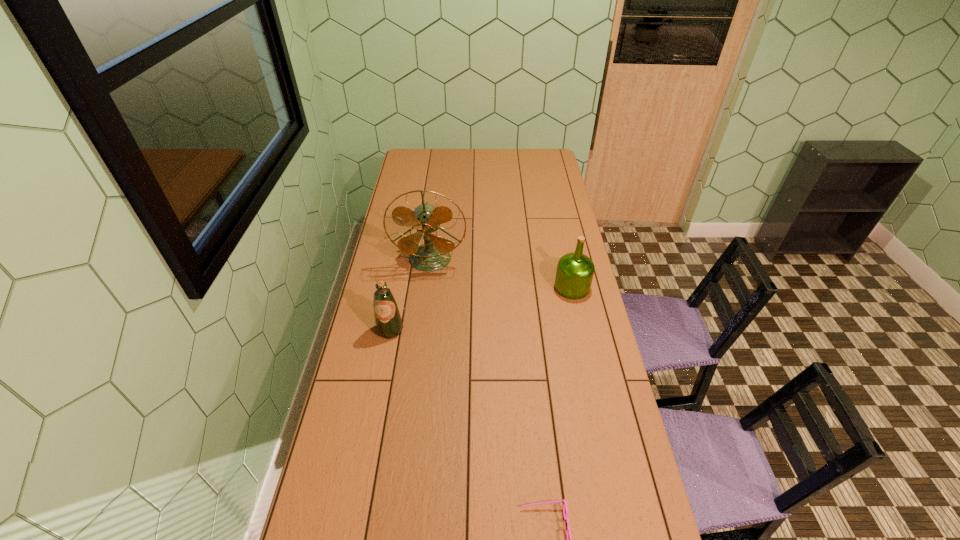
Identify the location of the tallest object. (434, 254).

What are the coordinates of `the right olive oil` in the screenshot? It's located at (574, 274).

You are a GUI agent. You are given a task and a screenshot of the screen. Output one action in this format:
    pyautogui.click(x=<x>, y=<y>)
    Task: Click on the farther olive oil
    
    Given the screenshot: What is the action you would take?
    pyautogui.click(x=574, y=274)

Locate an element on the screen. the nearer olive oil is located at coordinates (388, 322).

Where is `the second nearest object`? The image size is (960, 540). the second nearest object is located at coordinates (388, 322).

At what (x,y) coordinates should I click in order to perform the action: click on vacant space situated in front of the tallest object, directing air flow. Please return your answer as a coordinate pair (x, y). Looking at the image, I should click on (425, 296).

This screenshot has width=960, height=540. What are the coordinates of `vacant space located on the front of the rightmost object` in the screenshot? It's located at (589, 368).

Locate an element on the screen. The image size is (960, 540). vacant space located on the front-facing side of the left olive oil is located at coordinates (376, 401).

Identify the location of fan that is at the left edge. The width and height of the screenshot is (960, 540). (434, 254).

This screenshot has width=960, height=540. In order to click on olive oil positioned at the left edge in this screenshot , I will do `click(388, 322)`.